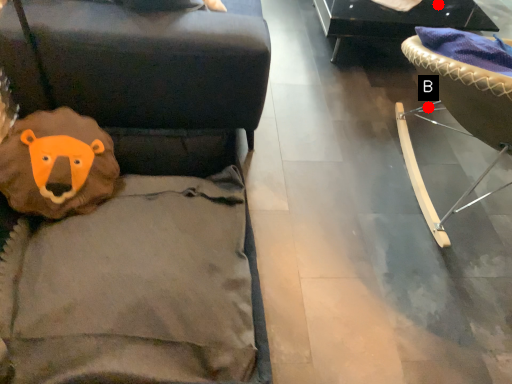
Question: Two points are circled on the image, labeled by A and B beside each circle. Which point is closer to the camera taking this photo?

Choices:
 (A) A is closer
 (B) B is closer

Answer: (B)